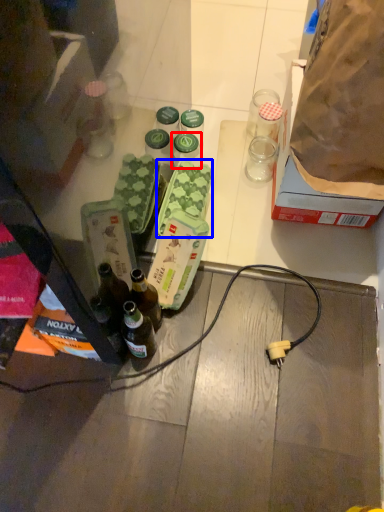
Question: Which of the following is the closest to the observer, bottle (highlighted by a red box) or food (highlighted by a blue box)?

Choices:
 (A) bottle
 (B) food

Answer: (B)